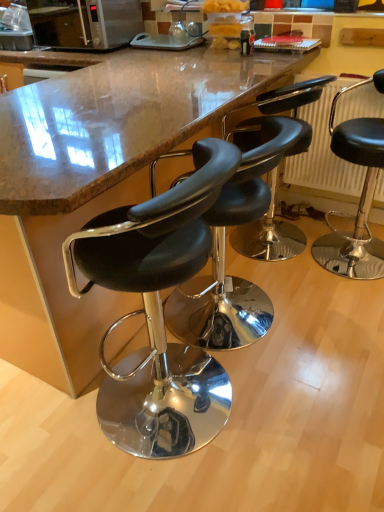
Question: From a real-world perspective, is black leather stool at center, which is the fourth chair in right-to-left order, above or below marble countertop at center?

Choices:
 (A) above
 (B) below

Answer: (A)

Question: From the image's perspective, is black leather stool at center, positioned as the first chair in left-to-right order, positioned above or below marble countertop at center?

Choices:
 (A) above
 (B) below

Answer: (B)

Question: Which object is positioned farthest from the metallic silver microwave at upper left?

Choices:
 (A) marble countertop at center
 (B) black leather stool at center, which is the 2th chair from right to left
 (C) metallic radiator at right
 (D) black leather stool at center, which appears as the 2th chair when viewed from the left
 (E) black leather stool at right, arranged as the 1th chair when viewed from the right

Answer: (E)

Question: Estimate the real-world distances between objects in this image. Which object is farther from the marble countertop at center?

Choices:
 (A) metallic silver microwave at upper left
 (B) metallic radiator at right
 (C) black leather stool at center, which is counted as the 3th chair, starting from the left
 (D) black leather stool at center, positioned as the first chair in left-to-right order
 (E) black leather stool at right, arranged as the 1th chair when viewed from the right

Answer: (E)